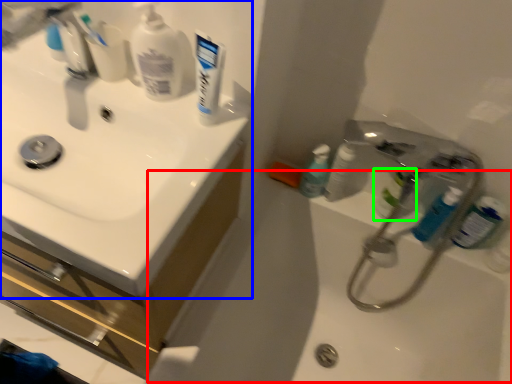
Question: Considering the real-world distances, which object is closest to bath (highlighted by a red box)? sink (highlighted by a blue box) or mouthwash (highlighted by a green box).

Choices:
 (A) sink
 (B) mouthwash

Answer: (B)